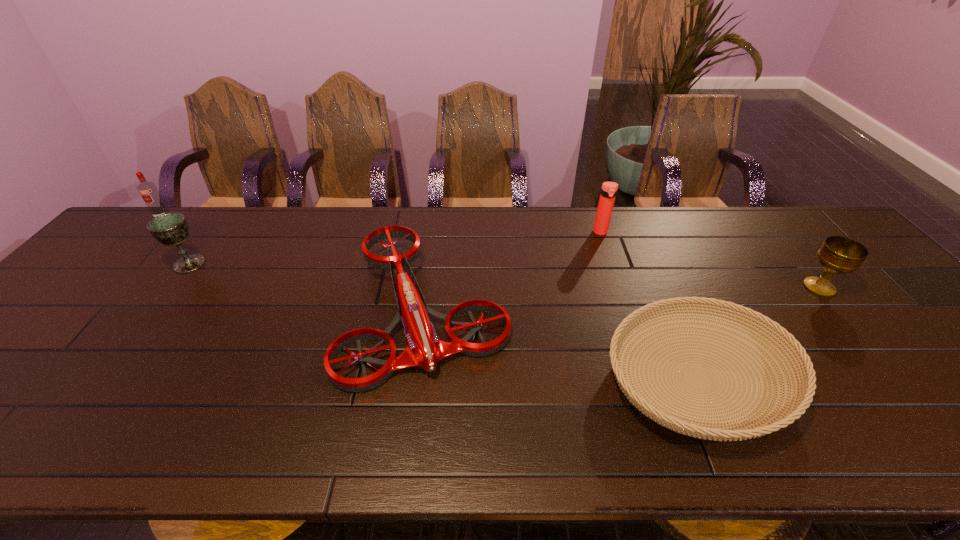
The image size is (960, 540). Find the location of `thermos bottle`. thermos bottle is located at coordinates (609, 189).

The height and width of the screenshot is (540, 960). Find the location of `vodka`. vodka is located at coordinates (148, 190).

Image resolution: width=960 pixels, height=540 pixels. Find the location of `the leftmost object`. the leftmost object is located at coordinates (148, 190).

You are a GUI agent. You are given a task and a screenshot of the screen. Output one action in this format:
    pyautogui.click(x=<x>, y=<y>)
    Task: Click on the farther chalice
    The height and width of the screenshot is (540, 960).
    Given the screenshot: What is the action you would take?
    pyautogui.click(x=170, y=229)

This screenshot has height=540, width=960. Identify the location of the fifth object from right to left. [170, 229].

In order to click on the rightmost object in this screenshot , I will do `click(838, 255)`.

Where is `the right chalice`? This screenshot has height=540, width=960. the right chalice is located at coordinates (838, 255).

Find the location of a particular element. Image resolution: width=960 pixels, height=540 pixels. the fourth object from right to left is located at coordinates (424, 349).

Where is `drone`? This screenshot has width=960, height=540. drone is located at coordinates (424, 349).

Find the location of `basket`. basket is located at coordinates (796, 405).